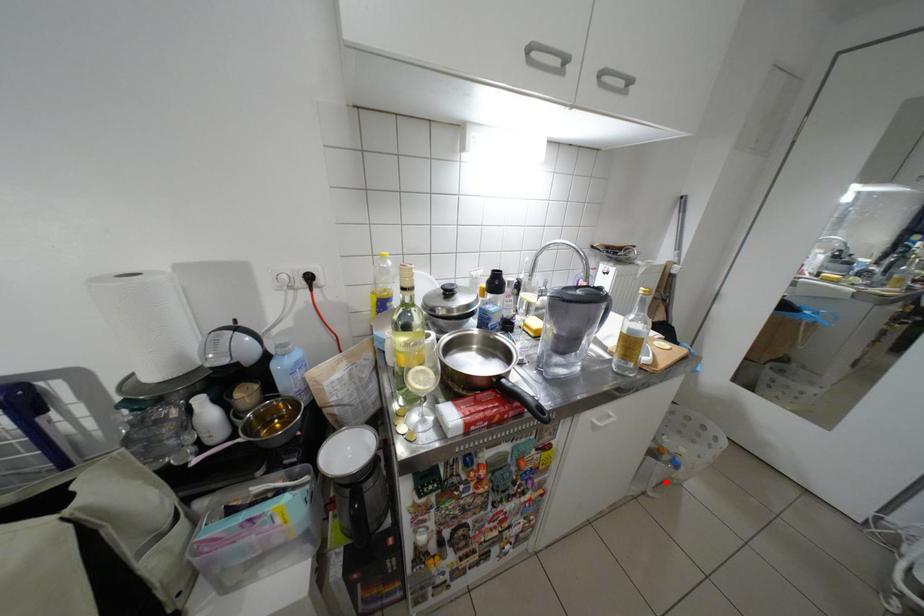
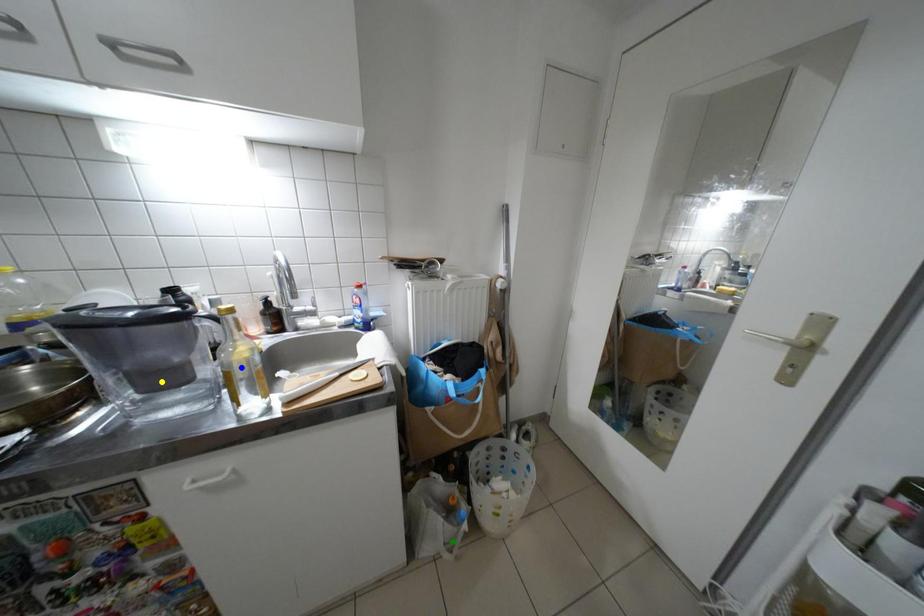
Question: I am providing you with two images of the same scene from different viewpoints. A red point is marked on the first image. You are given multiple points on the second image. Which point in image 2 represents the same 3d spot as the red point in image 1?

Choices:
 (A) yellow point
 (B) green point
 (C) blue point

Answer: (B)